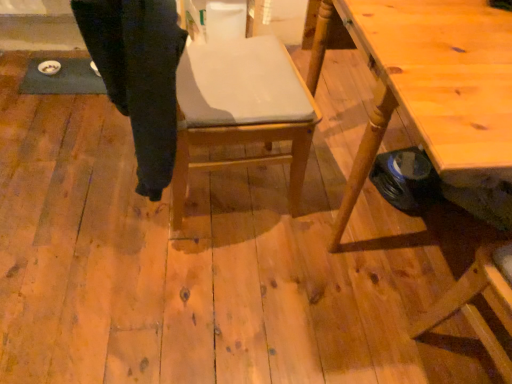
This screenshot has height=384, width=512. In order to click on free point in front of wooden chair at center in this screenshot , I will do `click(194, 281)`.